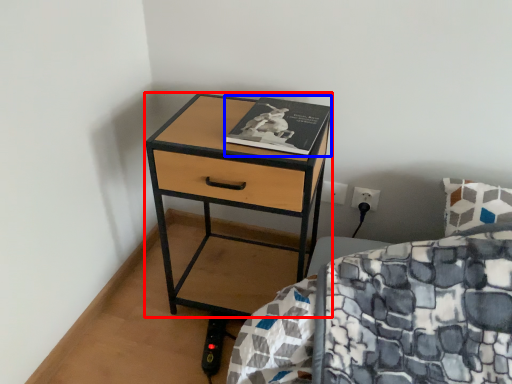
Question: Which point is further to the camera, nightstand (highlighted by a red box) or book (highlighted by a blue box)?

Choices:
 (A) nightstand
 (B) book

Answer: (B)